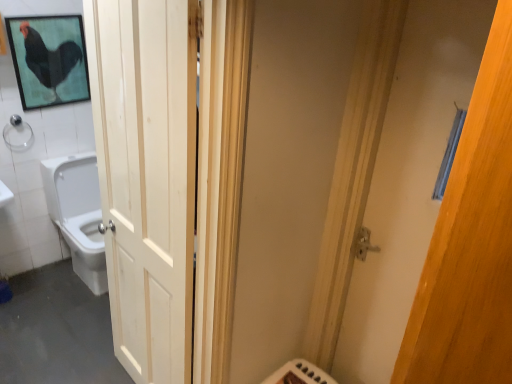
Question: Can you confirm if white wood door at left, the 1th door viewed from the left, is smaller than wooden door at right, arranged as the first door when viewed from the right?

Choices:
 (A) yes
 (B) no

Answer: (B)

Question: Is white wood door at left, the 1th door viewed from the left, at the right side of wooden door at right, arranged as the first door when viewed from the right?

Choices:
 (A) no
 (B) yes

Answer: (A)

Question: Does white wood door at left, the 1th door viewed from the left, come in front of wooden door at right, which ranks as the 2th door in left-to-right order?

Choices:
 (A) yes
 (B) no

Answer: (A)

Question: Can you confirm if white wood door at left, placed as the second door when sorted from right to left, is taller than wooden door at right, arranged as the first door when viewed from the right?

Choices:
 (A) no
 (B) yes

Answer: (B)

Question: From the image's perspective, is white wood door at left, the 1th door viewed from the left, on wooden door at right, arranged as the first door when viewed from the right?

Choices:
 (A) yes
 (B) no

Answer: (A)

Question: From a real-world perspective, is white wood door at left, placed as the second door when sorted from right to left, positioned above or below clear glass shower at upper left?

Choices:
 (A) above
 (B) below

Answer: (B)

Question: From the image's perspective, is white wood door at left, the 1th door viewed from the left, above or below clear glass shower at upper left?

Choices:
 (A) below
 (B) above

Answer: (A)

Question: In terms of width, does white wood door at left, placed as the second door when sorted from right to left, look wider or thinner when compared to clear glass shower at upper left?

Choices:
 (A) wide
 (B) thin

Answer: (A)

Question: From their relative heights in the image, would you say white wood door at left, placed as the second door when sorted from right to left, is taller or shorter than clear glass shower at upper left?

Choices:
 (A) tall
 (B) short

Answer: (A)

Question: Is white glossy toilet at left bigger or smaller than wooden door at right, arranged as the first door when viewed from the right?

Choices:
 (A) big
 (B) small

Answer: (A)

Question: From the image's perspective, is white glossy toilet at left located above or below wooden door at right, arranged as the first door when viewed from the right?

Choices:
 (A) below
 (B) above

Answer: (A)

Question: In terms of height, does white glossy toilet at left look taller or shorter compared to wooden door at right, which ranks as the 2th door in left-to-right order?

Choices:
 (A) tall
 (B) short

Answer: (B)

Question: Considering the relative positions of white glossy toilet at left and wooden door at right, arranged as the first door when viewed from the right, in the image provided, is white glossy toilet at left to the left or to the right of wooden door at right, arranged as the first door when viewed from the right,?

Choices:
 (A) right
 (B) left

Answer: (B)

Question: Looking at the image, does clear glass shower at upper left seem bigger or smaller compared to white glossy toilet at left?

Choices:
 (A) big
 (B) small

Answer: (B)

Question: In terms of width, does clear glass shower at upper left look wider or thinner when compared to white glossy toilet at left?

Choices:
 (A) thin
 (B) wide

Answer: (A)